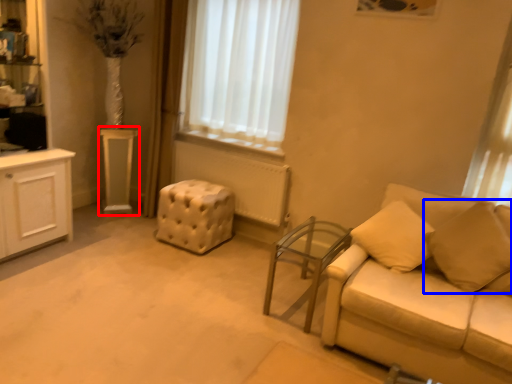
Question: Which object appears farthest to the camera in this image, table (highlighted by a red box) or pillow (highlighted by a blue box)?

Choices:
 (A) table
 (B) pillow

Answer: (A)